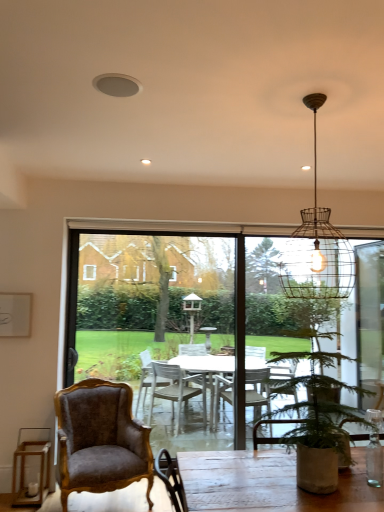
Question: Looking at the image, does wire mesh pendant light at upper center seem bigger or smaller compared to green leafy plant in pot at lower right?

Choices:
 (A) big
 (B) small

Answer: (B)

Question: Is wire mesh pendant light at upper center to the left or to the right of green leafy plant in pot at lower right in the image?

Choices:
 (A) left
 (B) right

Answer: (B)

Question: Considering the real-world distances, which object is farthest from the velvet brown armchair at lower left?

Choices:
 (A) wire mesh pendant light at upper center
 (B) green leafy plant in pot at lower right
 (C) transparent glass table at center

Answer: (A)

Question: Estimate the real-world distances between objects in this image. Which object is farther from the velvet brown armchair at lower left?

Choices:
 (A) green leafy plant in pot at lower right
 (B) transparent glass table at center
 (C) wire mesh pendant light at upper center

Answer: (C)